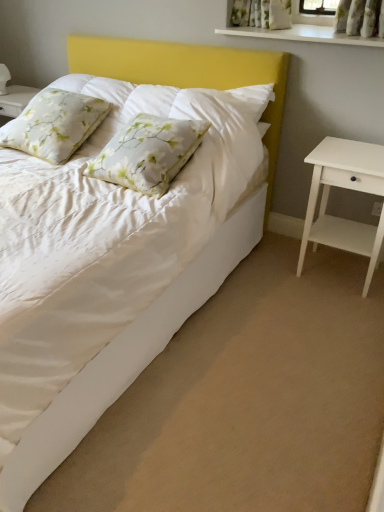
Question: Considering their positions, is floral fabric pillow at upper left, placed as the 2th pillow when sorted from right to left, located in front of or behind white matte nightstand at right?

Choices:
 (A) front
 (B) behind

Answer: (B)

Question: Considering the positions of point (x=31, y=134) and point (x=345, y=143), is point (x=31, y=134) closer or farther from the camera than point (x=345, y=143)?

Choices:
 (A) farther
 (B) closer

Answer: (A)

Question: Estimate the real-world distances between objects in this image. Which object is closer to the white glossy shelf at upper center?

Choices:
 (A) white matte nightstand at right
 (B) floral fabric pillow at upper left, the 1th pillow in the left-to-right sequence
 (C) white floral pillow at center, placed as the 1th pillow when sorted from right to left
 (D) white satin bed at lower left

Answer: (A)

Question: Which object is the closest to the white floral pillow at center, placed as the 1th pillow when sorted from right to left?

Choices:
 (A) white satin bed at lower left
 (B) white glossy shelf at upper center
 (C) floral fabric pillow at upper left, placed as the 2th pillow when sorted from right to left
 (D) white matte nightstand at right

Answer: (C)